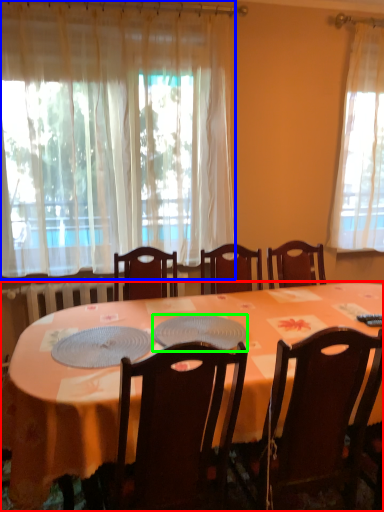
Question: Considering the real-world distances, which object is farthest from desk (highlighted by a red box)? curtain (highlighted by a blue box) or platter (highlighted by a green box)?

Choices:
 (A) curtain
 (B) platter

Answer: (A)